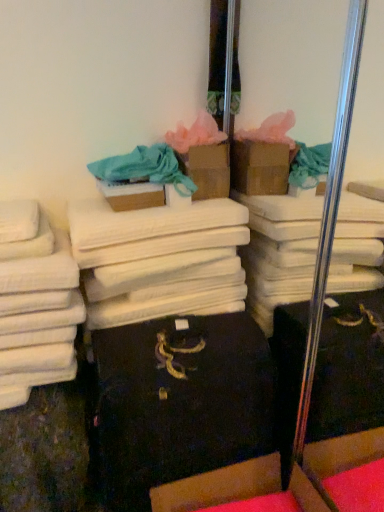
Question: In terms of height, does cardboard box at lower center, acting as the first cardboard box starting from the front, look taller or shorter compared to cardboard box at center, which is the 3th cardboard box from bottom to top?

Choices:
 (A) tall
 (B) short

Answer: (A)

Question: Is cardboard box at lower center, which ranks as the 3th cardboard box in top-to-bottom order, inside the boundaries of cardboard box at center, the 1th cardboard box viewed from the top, or outside?

Choices:
 (A) inside
 (B) outside

Answer: (B)

Question: Which of these objects is positioned closest to the brown cardboard box at center, which ranks as the second cardboard box in top-to-bottom order?

Choices:
 (A) cardboard box at lower center, the first cardboard box ordered from the bottom
 (B) matte blue fabric at upper center
 (C) white cotton towels at left
 (D) cardboard box at center, the 1th cardboard box viewed from the back
 (E) white cotton towels at center

Answer: (B)

Question: Which of these objects is positioned closest to the brown cardboard box at center, the second cardboard box positioned from the bottom?

Choices:
 (A) white cotton towels at left
 (B) matte blue fabric at upper center
 (C) cardboard box at center, the 1th cardboard box viewed from the back
 (D) white cotton towels at center
 (E) cardboard box at lower center, acting as the first cardboard box starting from the front

Answer: (B)